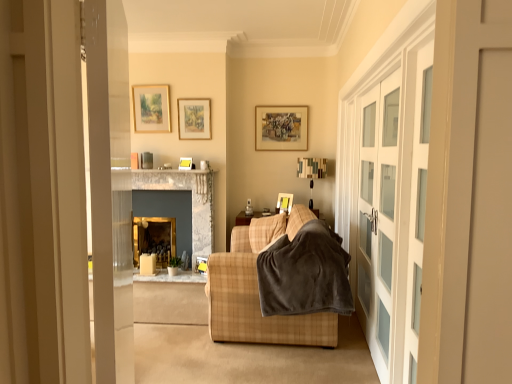
The width and height of the screenshot is (512, 384). What do you see at coordinates (201, 264) in the screenshot?
I see `wooden picture frame at center, the 6th picture frame when ordered from top to bottom` at bounding box center [201, 264].

Measure the distance between point (201, 272) and camera.

5.07 meters.

The height and width of the screenshot is (384, 512). In order to click on gold metallic fireplace at center, marked as the 2th fireplace in a right-to-left arrangement in this screenshot , I will do point(177,189).

This screenshot has width=512, height=384. Describe the element at coordinates (305, 274) in the screenshot. I see `velvety brown blanket at center` at that location.

This screenshot has height=384, width=512. In order to click on wooden picture frame at center, placed as the 3th picture frame when sorted from right to left in this screenshot , I will do `click(201, 264)`.

Considering the relative positions of clear glass cabinet at right, positioned as the 1th screen door in back-to-front order, and matte yellow picture frame at center, the 2th picture frame viewed from the left, in the image provided, is clear glass cabinet at right, positioned as the 1th screen door in back-to-front order, to the left of matte yellow picture frame at center, the 2th picture frame viewed from the left, from the viewer's perspective?

No.

From the image's perspective, does clear glass cabinet at right, positioned as the 1th screen door in back-to-front order, appear lower than matte yellow picture frame at center, the 2th picture frame viewed from the left?

Correct, clear glass cabinet at right, positioned as the 1th screen door in back-to-front order, appears lower than matte yellow picture frame at center, the 2th picture frame viewed from the left, in the image.

Which object is wider, clear glass cabinet at right, which is counted as the 2th screen door, starting from the front, or matte yellow picture frame at center, which is counted as the 5th picture frame, starting from the right?

matte yellow picture frame at center, which is counted as the 5th picture frame, starting from the right, is wider.

Is point (367, 122) positioned behind point (186, 169)?

That is False.

From a real-world perspective, is matte yellow picture frame at center, the 2th picture frame viewed from the left, positioned over clear glass cabinet at right, which is counted as the 2th screen door, starting from the front, based on gravity?

Indeed, from a real-world perspective, matte yellow picture frame at center, the 2th picture frame viewed from the left, stands above clear glass cabinet at right, which is counted as the 2th screen door, starting from the front.

Is matte yellow picture frame at center, which is counted as the 5th picture frame, starting from the right, thinner than clear glass cabinet at right, positioned as the 1th screen door in back-to-front order?

No.

From the image's perspective, between matte yellow picture frame at center, placed as the 4th picture frame when sorted from top to bottom, and clear glass cabinet at right, which is counted as the 2th screen door, starting from the front, which one is located above?

matte yellow picture frame at center, placed as the 4th picture frame when sorted from top to bottom, from the image's perspective.

Is matte yellow picture frame at center, the 2th picture frame viewed from the left, taller or shorter than clear glass cabinet at right, which is counted as the 2th screen door, starting from the front?

matte yellow picture frame at center, the 2th picture frame viewed from the left, is shorter than clear glass cabinet at right, which is counted as the 2th screen door, starting from the front.

Who is smaller, velvety brown blanket at center or plaid fabric couch at center?

Smaller between the two is velvety brown blanket at center.

Does velvety brown blanket at center have a greater height compared to plaid fabric couch at center?

In fact, velvety brown blanket at center may be shorter than plaid fabric couch at center.

From the image's perspective, which is below, velvety brown blanket at center or plaid fabric couch at center?

plaid fabric couch at center is shown below in the image.

Is velvety brown blanket at center oriented towards plaid fabric couch at center?

Yes, velvety brown blanket at center is aimed at plaid fabric couch at center.

Between matte wooden picture frame at upper center, placed as the 1th picture frame when sorted from left to right, and matte gold picture frame at upper center, which appears as the 2th picture frame when viewed from the top, which one has smaller width?

matte gold picture frame at upper center, which appears as the 2th picture frame when viewed from the top, is thinner.

Considering the positions of objects matte wooden picture frame at upper center, placed as the 6th picture frame when sorted from bottom to top, and matte gold picture frame at upper center, which is the third picture frame in left-to-right order, in the image provided, who is more to the left, matte wooden picture frame at upper center, placed as the 6th picture frame when sorted from bottom to top, or matte gold picture frame at upper center, which is the third picture frame in left-to-right order,?

Positioned to the left is matte wooden picture frame at upper center, placed as the 6th picture frame when sorted from bottom to top.

Is matte wooden picture frame at upper center, placed as the 1th picture frame when sorted from left to right, directly adjacent to matte gold picture frame at upper center, positioned as the fifth picture frame in bottom-to-top order?

They are not placed beside each other.

The image size is (512, 384). Find the location of `picture frame that is above the matte gold picture frame at upper center, which is the third picture frame in left-to-right order (from the image's perspective)`. picture frame that is above the matte gold picture frame at upper center, which is the third picture frame in left-to-right order (from the image's perspective) is located at coordinates (151, 108).

From a real-world perspective, is matte yellow picture frame at center, positioned as the 1th picture frame in right-to-left order, positioned over matte yellow picture frame at center, the 2th picture frame viewed from the left, based on gravity?

No, from a real-world perspective, matte yellow picture frame at center, positioned as the 1th picture frame in right-to-left order, is not over matte yellow picture frame at center, the 2th picture frame viewed from the left

Considering the relative sizes of matte yellow picture frame at center, which is counted as the fifth picture frame, starting from the top, and matte yellow picture frame at center, the 2th picture frame viewed from the left, in the image provided, is matte yellow picture frame at center, which is counted as the fifth picture frame, starting from the top, bigger than matte yellow picture frame at center, the 2th picture frame viewed from the left,?

Yes.

Does matte yellow picture frame at center, marked as the 6th picture frame in a left-to-right arrangement, touch matte yellow picture frame at center, the 2th picture frame viewed from the left?

No, matte yellow picture frame at center, marked as the 6th picture frame in a left-to-right arrangement, is not next to matte yellow picture frame at center, the 2th picture frame viewed from the left.

How many degrees apart are the facing directions of matte yellow picture frame at center, which is counted as the fifth picture frame, starting from the top, and matte yellow picture frame at center, placed as the 4th picture frame when sorted from top to bottom?

There is a 2.07-degree angle between the facing directions of matte yellow picture frame at center, which is counted as the fifth picture frame, starting from the top, and matte yellow picture frame at center, placed as the 4th picture frame when sorted from top to bottom.

Which object is positioned more to the right, matte gold picture frame at upper center, which is the third picture frame in left-to-right order, or matte wooden picture frame at upper center, placed as the sixth picture frame when sorted from right to left?

matte gold picture frame at upper center, which is the third picture frame in left-to-right order.

Considering the relative positions of matte gold picture frame at upper center, which is the third picture frame in left-to-right order, and matte wooden picture frame at upper center, which is the 1th picture frame from top to bottom, in the image provided, is matte gold picture frame at upper center, which is the third picture frame in left-to-right order, behind matte wooden picture frame at upper center, which is the 1th picture frame from top to bottom,?

No, it is in front of matte wooden picture frame at upper center, which is the 1th picture frame from top to bottom.

Which of these two, matte gold picture frame at upper center, acting as the 4th picture frame starting from the right, or matte wooden picture frame at upper center, placed as the 1th picture frame when sorted from left to right, is thinner?

matte gold picture frame at upper center, acting as the 4th picture frame starting from the right, is thinner.

In the scene shown: Is matte gold picture frame at upper center, positioned as the fifth picture frame in bottom-to-top order, oriented towards matte wooden picture frame at upper center, placed as the 6th picture frame when sorted from bottom to top?

No, matte gold picture frame at upper center, positioned as the fifth picture frame in bottom-to-top order, does not turn towards matte wooden picture frame at upper center, placed as the 6th picture frame when sorted from bottom to top.

Considering the sizes of wooden picture frame at center, the 6th picture frame when ordered from top to bottom, and plaid fabric couch at center in the image, is wooden picture frame at center, the 6th picture frame when ordered from top to bottom, taller or shorter than plaid fabric couch at center?

Clearly, wooden picture frame at center, the 6th picture frame when ordered from top to bottom, is shorter compared to plaid fabric couch at center.

Can you confirm if wooden picture frame at center, placed as the first picture frame when sorted from bottom to top, is thinner than plaid fabric couch at center?

Yes, wooden picture frame at center, placed as the first picture frame when sorted from bottom to top, is thinner than plaid fabric couch at center.

Where is `the 1st picture frame to the left of the plaid fabric couch at center, starting your count from the anchor`? the 1st picture frame to the left of the plaid fabric couch at center, starting your count from the anchor is located at coordinates (201, 264).

Can you confirm if wooden picture frame at center, placed as the first picture frame when sorted from bottom to top, is positioned to the left of plaid fabric couch at center?

Indeed, wooden picture frame at center, placed as the first picture frame when sorted from bottom to top, is positioned on the left side of plaid fabric couch at center.

You are a GUI agent. You are given a task and a screenshot of the screen. Output one action in this format:
    pyautogui.click(x=<x>, y=<y>)
    Task: Click on the picture frame that is the 5th object to the left of the clear glass cabinet at right, positioned as the 1th screen door in back-to-front order, starting at the anchor
    This screenshot has width=512, height=384.
    Given the screenshot: What is the action you would take?
    pyautogui.click(x=185, y=163)

Identify the location of picture frame that is the 1st object above the clear glass cabinet at right, which is counted as the 2th screen door, starting from the front (from a real-world perspective). This screenshot has width=512, height=384. (185, 163).

Estimate the real-world distances between objects in this image. Which object is further from matte wooden picture frame at upper center, which is the 1th picture frame from top to bottom, matte yellow picture frame at center, which is counted as the 5th picture frame, starting from the right, or velvety brown blanket at center?

velvety brown blanket at center is further to matte wooden picture frame at upper center, which is the 1th picture frame from top to bottom.

Based on the photo, considering their positions, is wooden picture frame at center, which is the fourth picture frame from left to right, positioned closer to matte yellow picture frame at center, which ranks as the second picture frame in bottom-to-top order, than matte gold picture frame at upper center, positioned as the fifth picture frame in bottom-to-top order?

wooden picture frame at center, which is the fourth picture frame from left to right, lies closer to matte yellow picture frame at center, which ranks as the second picture frame in bottom-to-top order, than the other object.

Looking at the image, which one is located closer to matte gold picture frame at upper center, acting as the 4th picture frame starting from the right, white glass cabinet doors at right, the second screen door from the back, or matte yellow picture frame at center, which ranks as the second picture frame in bottom-to-top order?

matte yellow picture frame at center, which ranks as the second picture frame in bottom-to-top order, is closer to matte gold picture frame at upper center, acting as the 4th picture frame starting from the right.

Considering their positions, is wooden picture frame at center, placed as the first picture frame when sorted from bottom to top, positioned further to clear glass cabinet at right, which is counted as the 2th screen door, starting from the front, than matte yellow picture frame at center, which is counted as the 5th picture frame, starting from the right?

The object further to clear glass cabinet at right, which is counted as the 2th screen door, starting from the front, is wooden picture frame at center, placed as the first picture frame when sorted from bottom to top.

From the image, which object appears to be nearer to wooden picture frame at upper center, acting as the 2th picture frame starting from the right, velvety brown blanket at center or matte wooden picture frame at upper center, placed as the sixth picture frame when sorted from right to left?

matte wooden picture frame at upper center, placed as the sixth picture frame when sorted from right to left, is closer to wooden picture frame at upper center, acting as the 2th picture frame starting from the right.

When comparing their distances from matte yellow picture frame at center, marked as the third picture frame in a bottom-to-top arrangement, does matte wooden picture frame at upper center, placed as the 1th picture frame when sorted from left to right, or matte gold picture frame at upper center, which appears as the 2th picture frame when viewed from the top, seem further?

Among the two, matte wooden picture frame at upper center, placed as the 1th picture frame when sorted from left to right, is located further to matte yellow picture frame at center, marked as the third picture frame in a bottom-to-top arrangement.

Estimate the real-world distances between objects in this image. Which object is further from matte wooden picture frame at upper center, placed as the sixth picture frame when sorted from right to left, matte yellow picture frame at center, which is counted as the 5th picture frame, starting from the right, or matte gold picture frame at upper center, which appears as the 2th picture frame when viewed from the top?

Based on the image, matte yellow picture frame at center, which is counted as the 5th picture frame, starting from the right, appears to be further to matte wooden picture frame at upper center, placed as the sixth picture frame when sorted from right to left.

From the image, which object appears to be farther from velvety brown blanket at center, clear glass cabinet at right, which is counted as the 2th screen door, starting from the front, or gold metallic fireplace at center, the 1th fireplace when ordered from right to left?

Based on the image, gold metallic fireplace at center, the 1th fireplace when ordered from right to left, appears to be further to velvety brown blanket at center.

You are a GUI agent. You are given a task and a screenshot of the screen. Output one action in this format:
    pyautogui.click(x=<x>, y=<y>)
    Task: Click on the blanket between white glass cabinet doors at right, the second screen door from the back, and gold metallic fireplace at center, marked as the 2th fireplace in a right-to-left arrangement, in the front-back direction
    The width and height of the screenshot is (512, 384).
    Given the screenshot: What is the action you would take?
    pyautogui.click(x=305, y=274)

Where is `studio couch between velvety brown blanket at center and matte yellow picture frame at center, marked as the 6th picture frame in a left-to-right arrangement, in the front-back direction`? studio couch between velvety brown blanket at center and matte yellow picture frame at center, marked as the 6th picture frame in a left-to-right arrangement, in the front-back direction is located at coordinates (258, 290).

At what (x,y) coordinates should I click in order to perform the action: click on screen door located between velvety brown blanket at center and matte yellow picture frame at center, which is counted as the fifth picture frame, starting from the top, in the depth direction. Please return your answer as a coordinate pair (x, y). Image resolution: width=512 pixels, height=384 pixels. Looking at the image, I should click on (367, 211).

Identify the location of fireplace between velvety brown blanket at center and matte yellow picture frame at center, which is counted as the 5th picture frame, starting from the right, from front to back. The image size is (512, 384). (177, 189).